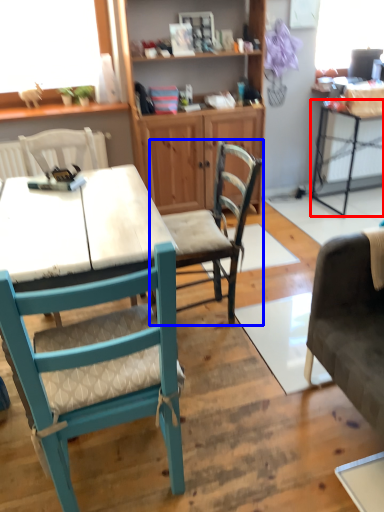
Question: Among these objects, which one is farthest to the camera, table (highlighted by a red box) or chair (highlighted by a blue box)?

Choices:
 (A) table
 (B) chair

Answer: (A)